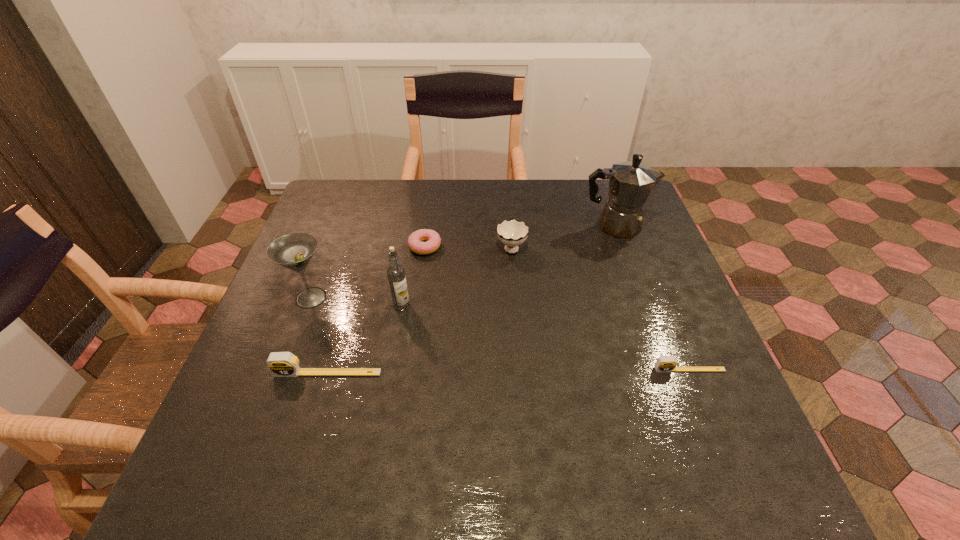
At what (x,y) coordinates should I click in order to perform the action: click on vacant space that satisfies the following two spatial constraints: 1. on the pouring side of the tallest object; 2. on the label of the vodka. Please return your answer as a coordinate pair (x, y). This screenshot has width=960, height=540. Looking at the image, I should click on (643, 306).

I want to click on vacant space that satisfies the following two spatial constraints: 1. on the pouring side of the coffeepot; 2. on the front side of the martini, so click(x=640, y=298).

Where is `free space that satisfies the following two spatial constraints: 1. on the pouring side of the tallest object; 2. at the front of the taller tape measure with the tape extended`? The height and width of the screenshot is (540, 960). free space that satisfies the following two spatial constraints: 1. on the pouring side of the tallest object; 2. at the front of the taller tape measure with the tape extended is located at coordinates (667, 373).